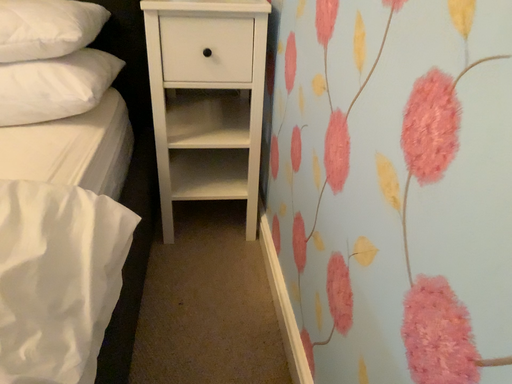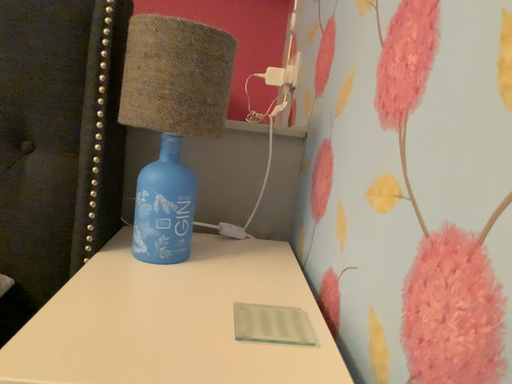
Question: How did the camera likely rotate when shooting the video?

Choices:
 (A) rotated upward
 (B) rotated downward

Answer: (A)